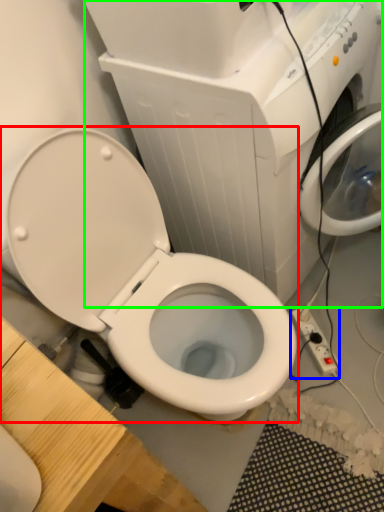
Question: Based on their relative distances, which object is farther from toilet (highlighted by a red box)? Choose from electric outlet (highlighted by a blue box) and appliance (highlighted by a green box).

Choices:
 (A) electric outlet
 (B) appliance

Answer: (A)